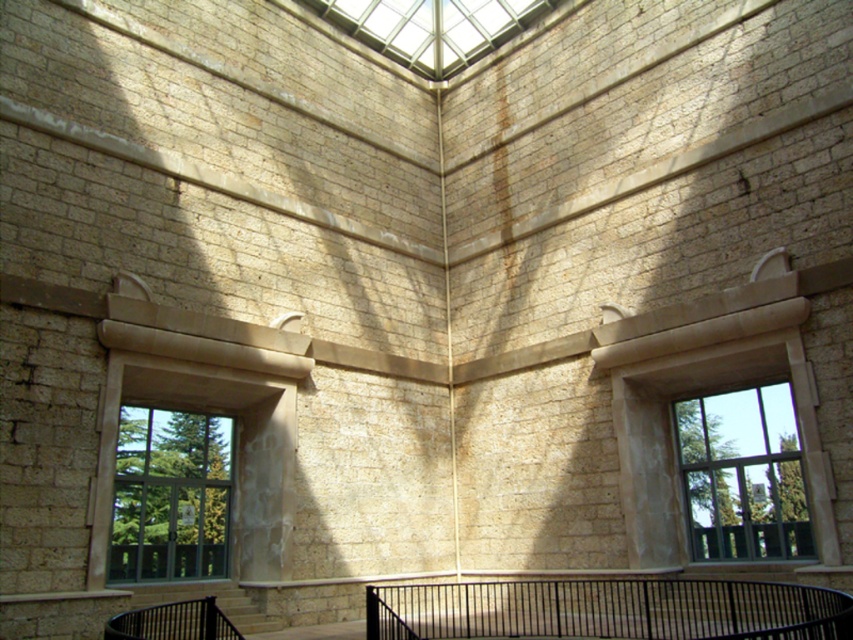
Which is above, clear glass window at right or transparent glass skylight at upper center?

transparent glass skylight at upper center

Is point (695, 481) positioned after point (331, 19)?

That is False.

Between point (706, 499) and point (492, 35), which one is positioned behind?

Positioned behind is point (492, 35).

Locate an element on the screen. clear glass window at right is located at coordinates (743, 476).

Who is more distant from viewer, [161,516] or [489,40]?

The point [489,40] is more distant.

Based on the photo, does clear glass window at left appear on the left side of transparent glass skylight at upper center?

Indeed, clear glass window at left is positioned on the left side of transparent glass skylight at upper center.

Locate an element on the screen. clear glass window at left is located at coordinates (170, 496).

Is clear glass window at right bigger than clear glass window at left?

Yes, clear glass window at right is bigger than clear glass window at left.

Does clear glass window at right appear over clear glass window at left?

Correct, clear glass window at right is located above clear glass window at left.

Who is more forward, (711, 538) or (148, 429)?

Point (148, 429) is in front.

This screenshot has width=853, height=640. In order to click on clear glass window at right in this screenshot , I will do `click(743, 476)`.